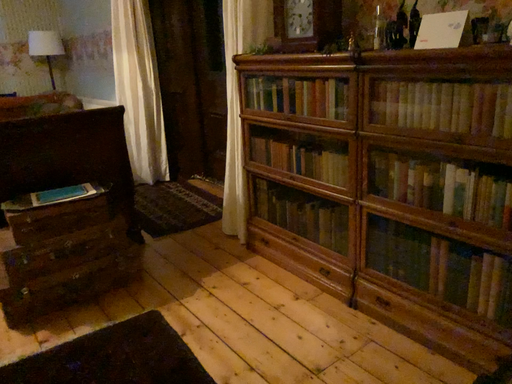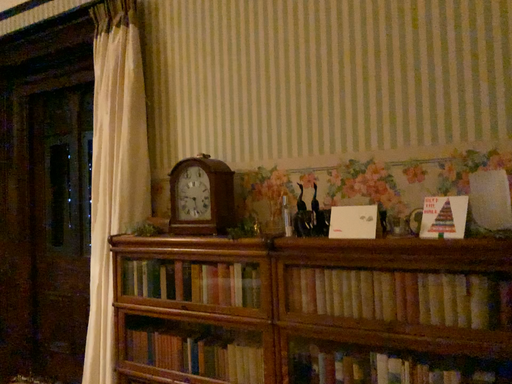
Question: Which way did the camera rotate in the video?

Choices:
 (A) rotated upward
 (B) rotated downward

Answer: (A)